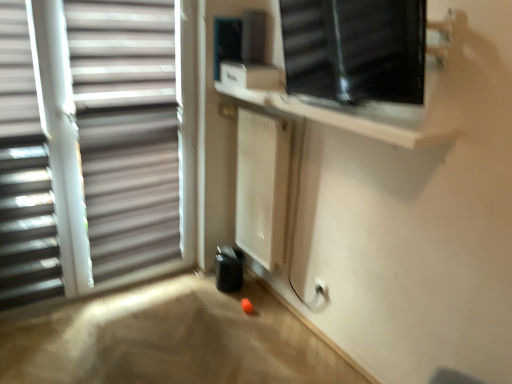
Locate an element on the screen. The image size is (512, 384). vacant area that is in front of white matte window at left, which appears as the first window when viewed from the left is located at coordinates (80, 338).